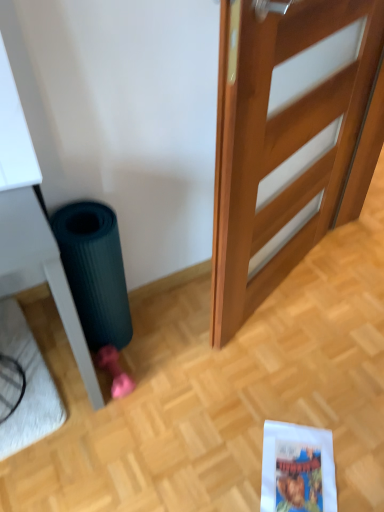
Locate an element on the screen. free area in between dark green rubber mat at lower left and blue glossy comic book at lower right is located at coordinates click(207, 400).